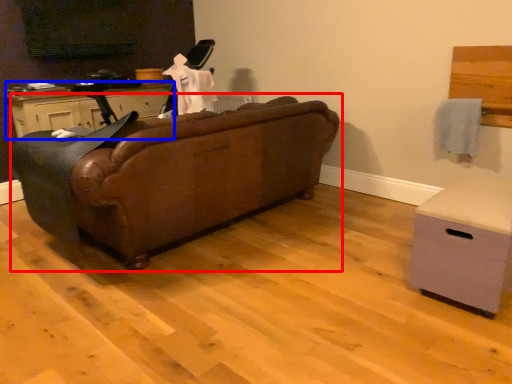
Question: Among these objects, which one is nearest to the camera, studio couch (highlighted by a red box) or cabinetry (highlighted by a blue box)?

Choices:
 (A) studio couch
 (B) cabinetry

Answer: (A)